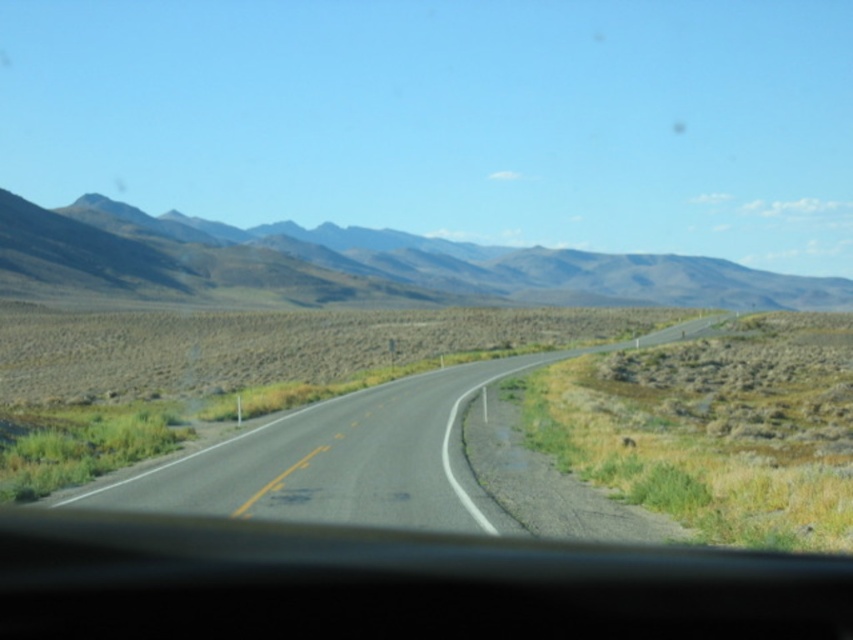
Can you confirm if gray rocky mountain at upper center is taller than asphalt road at center?

Yes, gray rocky mountain at upper center is taller than asphalt road at center.

Between gray rocky mountain at upper center and asphalt road at center, which one is positioned higher?

gray rocky mountain at upper center

Looking at this image, who is more forward, (x=9, y=202) or (x=412, y=438)?

Point (x=412, y=438) is in front.

Where is `gray rocky mountain at upper center`? The width and height of the screenshot is (853, 640). gray rocky mountain at upper center is located at coordinates (358, 264).